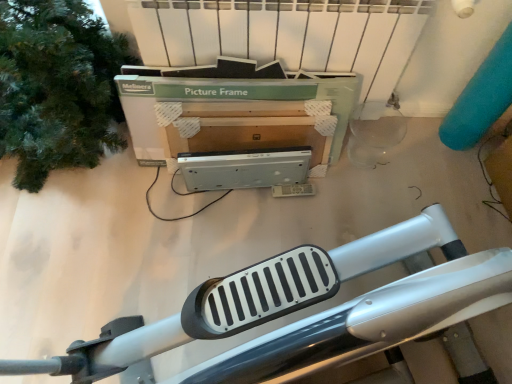
Question: Does green cardboard picture frame at upper center have a greater height compared to green matte tree at left?

Choices:
 (A) yes
 (B) no

Answer: (B)

Question: Is green cardboard picture frame at upper center turned away from green matte tree at left?

Choices:
 (A) yes
 (B) no

Answer: (B)

Question: Does green cardboard picture frame at upper center have a smaller size compared to green matte tree at left?

Choices:
 (A) no
 (B) yes

Answer: (B)

Question: Is green cardboard picture frame at upper center aimed at green matte tree at left?

Choices:
 (A) yes
 (B) no

Answer: (B)

Question: Does green cardboard picture frame at upper center have a greater width compared to green matte tree at left?

Choices:
 (A) no
 (B) yes

Answer: (A)

Question: Is silver metallic exercise machine at lower center taller or shorter than green cardboard picture frame at upper center?

Choices:
 (A) short
 (B) tall

Answer: (A)

Question: Would you say silver metallic exercise machine at lower center is inside or outside green cardboard picture frame at upper center?

Choices:
 (A) outside
 (B) inside

Answer: (A)

Question: From a real-world perspective, relative to green cardboard picture frame at upper center, is silver metallic exercise machine at lower center vertically above or below?

Choices:
 (A) below
 (B) above

Answer: (A)

Question: Visually, is silver metallic exercise machine at lower center positioned to the left or to the right of green cardboard picture frame at upper center?

Choices:
 (A) right
 (B) left

Answer: (A)

Question: Is green cardboard picture frame at upper center in front of or behind silver metallic exercise machine at lower center in the image?

Choices:
 (A) behind
 (B) front

Answer: (B)

Question: In terms of size, does green cardboard picture frame at upper center appear bigger or smaller than silver metallic exercise machine at lower center?

Choices:
 (A) small
 (B) big

Answer: (A)

Question: Considering the positions of point (332, 97) and point (103, 344), is point (332, 97) closer or farther from the camera than point (103, 344)?

Choices:
 (A) farther
 (B) closer

Answer: (A)

Question: Is green cardboard picture frame at upper center taller or shorter than silver metallic exercise machine at lower center?

Choices:
 (A) short
 (B) tall

Answer: (B)

Question: Visually, is green matte tree at left positioned to the left or to the right of green cardboard picture frame at upper center?

Choices:
 (A) right
 (B) left

Answer: (B)

Question: Is green matte tree at left taller or shorter than green cardboard picture frame at upper center?

Choices:
 (A) tall
 (B) short

Answer: (A)